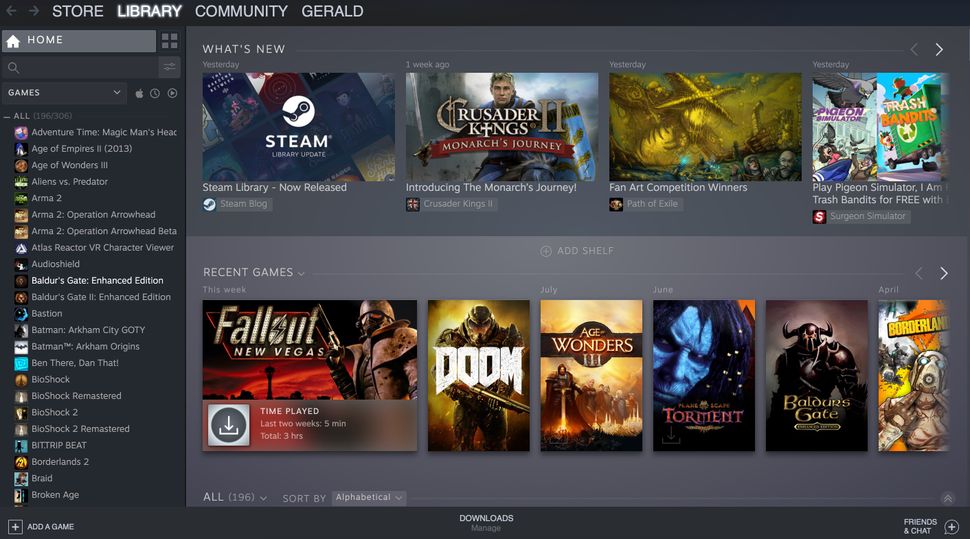
You are a GUI agent. You are given a task and a screenshot of the screen. Output one action in this format:
    pyautogui.click(x=<x>, y=<y>)
    Task: Click on the chest
    
    Given the screenshot: What is the action you would take?
    click(x=370, y=363)